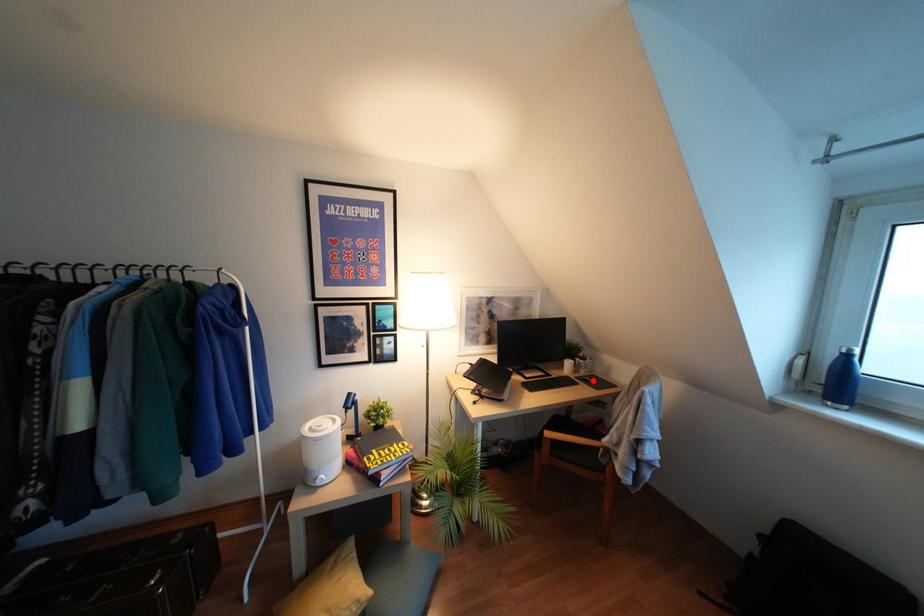
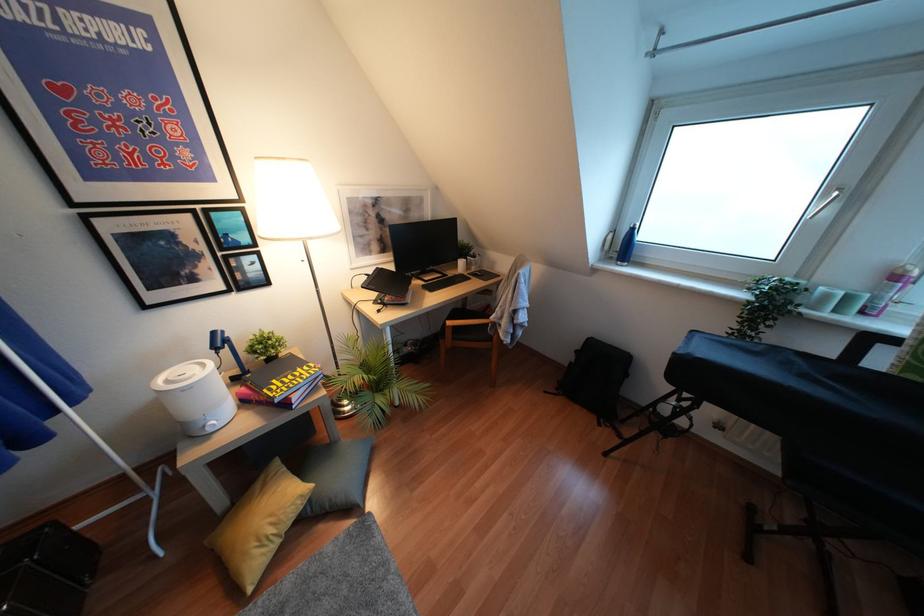
In the second image, find the point that corresponds to the highlighted location in the first image.

(481, 274)